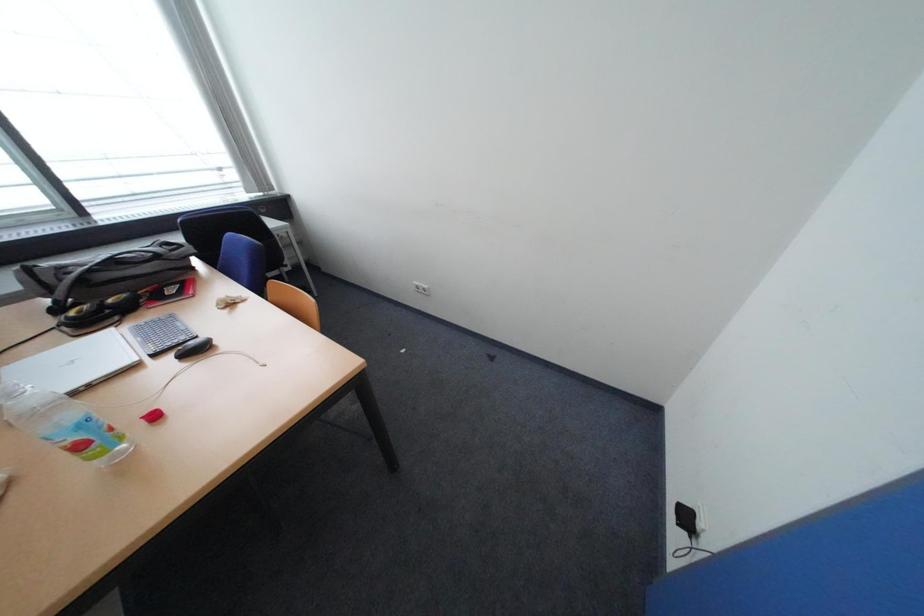
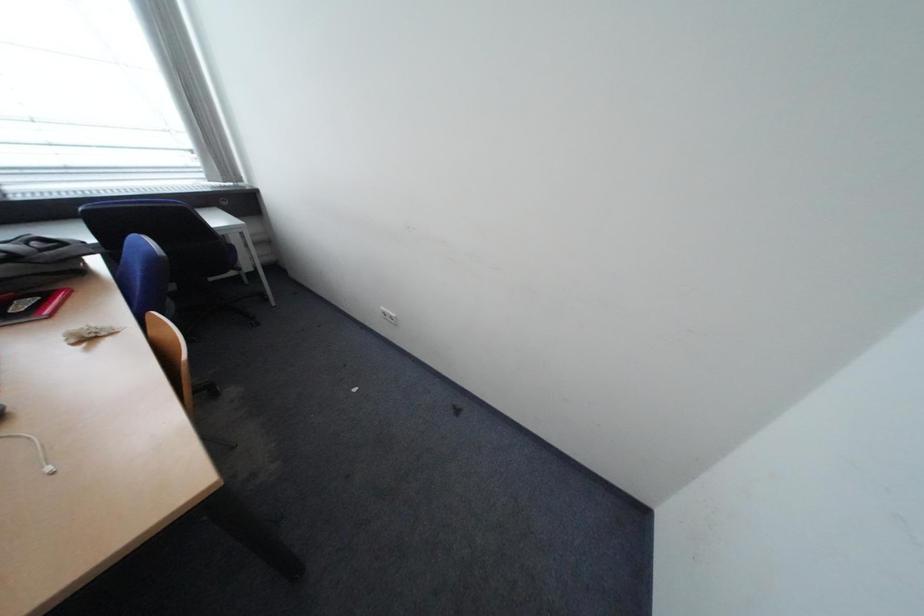
Question: How did the camera likely rotate?

Choices:
 (A) Left
 (B) Right
 (C) Up
 (D) Down

Answer: (C)